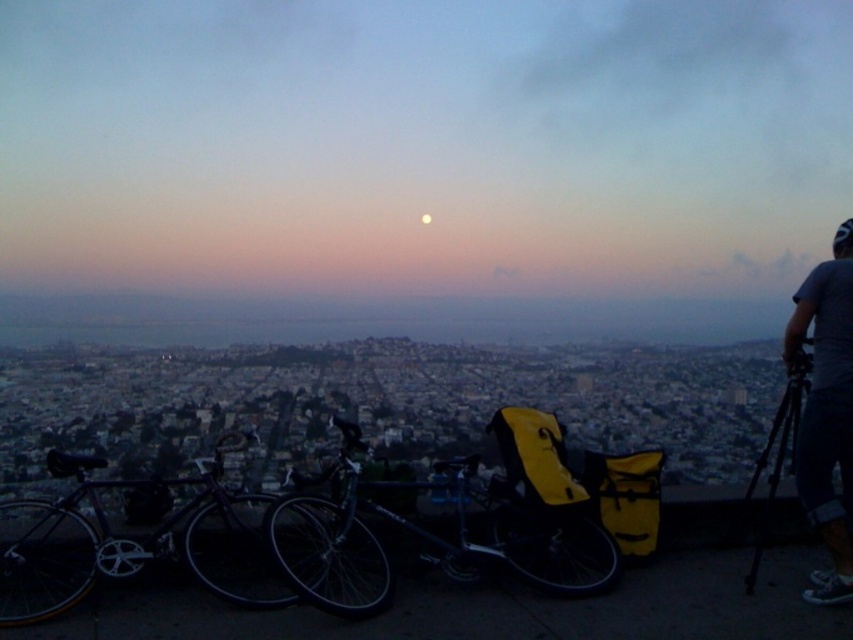
Locate an element on the screen. The image size is (853, 640). blue denim shorts at right is located at coordinates (827, 412).

Can you confirm if blue denim shorts at right is positioned below black matte tripod at right?

Incorrect, blue denim shorts at right is not positioned below black matte tripod at right.

Between point (814, 582) and point (802, 372), which one is positioned behind?

Point (802, 372)

I want to click on blue denim shorts at right, so click(827, 412).

Can you confirm if shiny metallic bicycle at center is positioned above black matte tripod at right?

No.

Between point (556, 563) and point (758, 468), which one is positioned in front?

Point (556, 563) is in front.

Between point (602, 580) and point (759, 456), which one is positioned in front?

Point (602, 580)

This screenshot has height=640, width=853. Identify the location of shiny metallic bicycle at center. (456, 522).

Does shiny metallic bicycle at center come behind shiny black bicycle at left?

Yes, shiny metallic bicycle at center is further from the viewer.

In order to click on shiny metallic bicycle at center in this screenshot , I will do `click(456, 522)`.